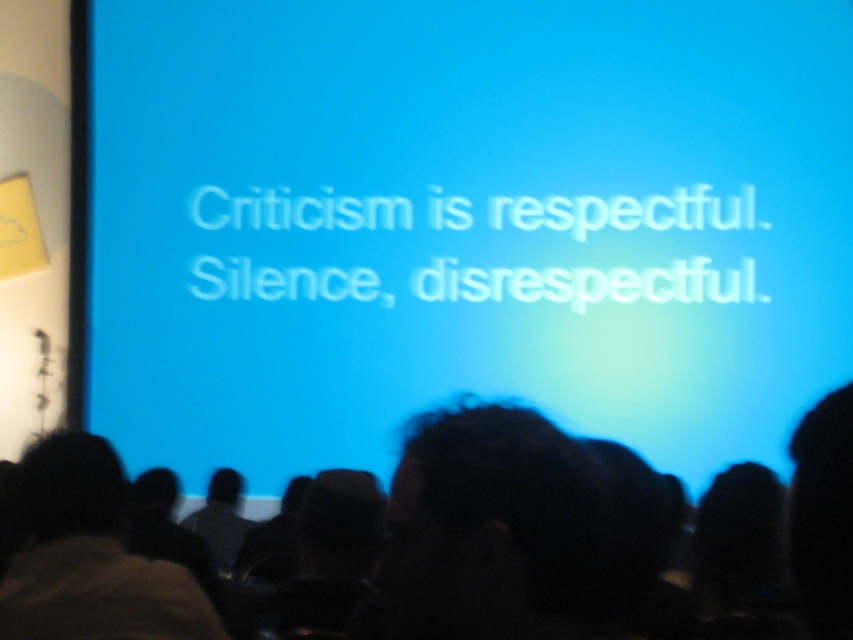
Which is more to the left, dark hair at center or dark hair at lower left?

dark hair at lower left is more to the left.

Can you confirm if dark hair at center is bigger than dark hair at lower left?

Indeed, dark hair at center has a larger size compared to dark hair at lower left.

Who is more distant from viewer, (494, 584) or (186, 588)?

The point (186, 588) is behind.

Where is `dark hair at center`? dark hair at center is located at coordinates [x=822, y=515].

Is blue matte screen at center positioned before dark hair at center?

No, it is behind dark hair at center.

Does blue matte screen at center appear over dark hair at center?

Indeed, blue matte screen at center is positioned over dark hair at center.

Who is more distant from viewer, (653, 296) or (511, 596)?

The point (653, 296) is more distant.

Where is `blue matte screen at center`? blue matte screen at center is located at coordinates (463, 225).

Does blue matte screen at center have a greater height compared to dark hair at lower left?

Yes, blue matte screen at center is taller than dark hair at lower left.

Is blue matte screen at center bigger than dark hair at lower left?

Correct, blue matte screen at center is larger in size than dark hair at lower left.

Does point (195, 168) come closer to viewer compared to point (74, 595)?

No, it is behind (74, 595).

I want to click on blue matte screen at center, so click(463, 225).